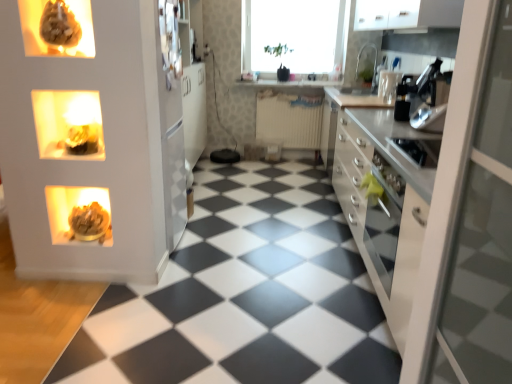
Question: From the image's perspective, relative to white glossy countertop at center, is black plastic coffee maker at upper right, the second appliance positioned from the right, above or below?

Choices:
 (A) below
 (B) above

Answer: (A)

Question: Is black plastic coffee maker at upper right, positioned as the 3th appliance in left-to-right order, in front of or behind white glossy countertop at center in the image?

Choices:
 (A) front
 (B) behind

Answer: (A)

Question: Which object is positioned closest to the transparent glass window at upper center?

Choices:
 (A) white glossy countertop at center
 (B) satin white countertop at right
 (C) matte brown sculpture at upper left, placed as the third appliance when sorted from right to left
 (D) black rubber tile at center
 (E) matte gold candle at upper left

Answer: (A)

Question: Estimate the real-world distances between objects in this image. Which object is closer to the black rubber tile at center?

Choices:
 (A) clear glass cup at upper right, which is the fourth appliance in bottom-to-top order
 (B) white matte cabinet at upper right
 (C) transparent glass window at upper center
 (D) matte brown sculpture at upper left, placed as the 1th appliance when sorted from front to back
 (E) black plastic coffee maker at upper right, positioned as the 3th appliance in left-to-right order

Answer: (E)